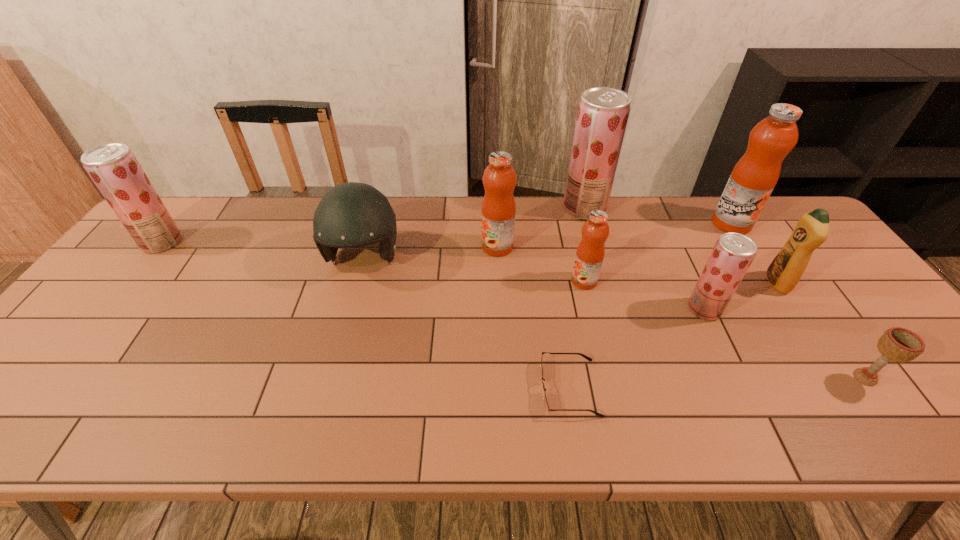
This screenshot has width=960, height=540. Identify the location of object at the right edge. (897, 344).

The width and height of the screenshot is (960, 540). Find the location of `object that is at the far left corner`. object that is at the far left corner is located at coordinates (113, 167).

Image resolution: width=960 pixels, height=540 pixels. Identify the location of vacant region at the far edge of the desktop. (628, 233).

Where is `vacant region at the near edge`? The image size is (960, 540). vacant region at the near edge is located at coordinates (324, 413).

You are a GUI agent. You are given a task and a screenshot of the screen. Output one action in this format:
    pyautogui.click(x=<x>, y=<y>)
    Task: Click on the vacant space at the left edge of the desktop
    This screenshot has height=540, width=960.
    Given the screenshot: What is the action you would take?
    pyautogui.click(x=98, y=334)

At what (x,y) coordinates should I click in order to perform the action: click on vacant region at the far left corner of the desktop. Please return your answer as a coordinate pair (x, y). Looking at the image, I should click on (198, 200).

Identify the location of vacant space at the near right corner of the desktop. Image resolution: width=960 pixels, height=540 pixels. (906, 435).

Identify the location of vacant region between the second smallest strawberry fruit juice and the detergent. (469, 262).

Identify the location of vacant area that lies between the second strawberry fruit juice from left to right and the spectacles. The height and width of the screenshot is (540, 960). (577, 299).

This screenshot has height=540, width=960. In order to click on vacant area between the second nearest strawberry fruit juice and the shortest object in this screenshot , I will do [x=366, y=315].